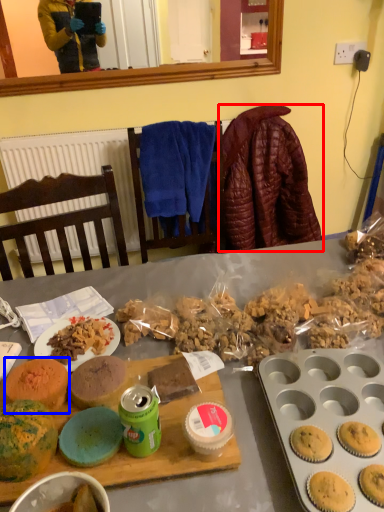
Question: Which of the following is the closest to the observer, blanket (highlighted by a red box) or snack (highlighted by a blue box)?

Choices:
 (A) blanket
 (B) snack

Answer: (B)